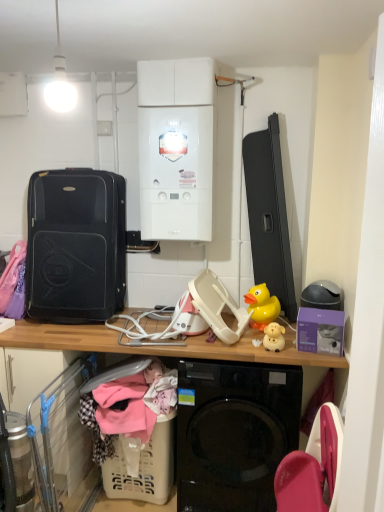
Image resolution: width=384 pixels, height=512 pixels. Find the location of `vacant space in front of yellow rubber duck at upper right, which appears as the 2th toy when viewed from the front`. vacant space in front of yellow rubber duck at upper right, which appears as the 2th toy when viewed from the front is located at coordinates (265, 339).